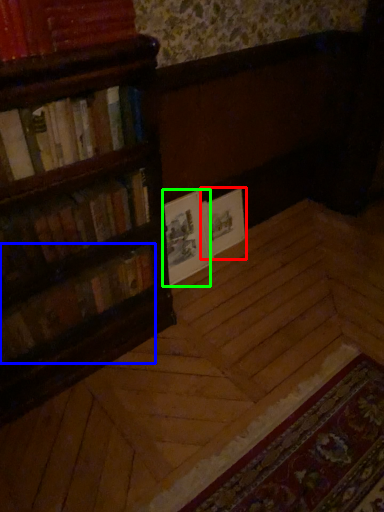
Question: Which object is the farthest from book cover (highlighted by a red box)? Choose among these: book (highlighted by a blue box) or paperback book (highlighted by a green box).

Choices:
 (A) book
 (B) paperback book

Answer: (A)